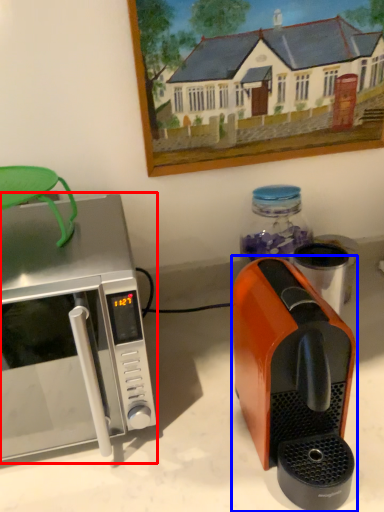
Question: Among these objects, which one is farthest to the camera, microwave oven (highlighted by a red box) or coffee maker (highlighted by a blue box)?

Choices:
 (A) microwave oven
 (B) coffee maker

Answer: (A)